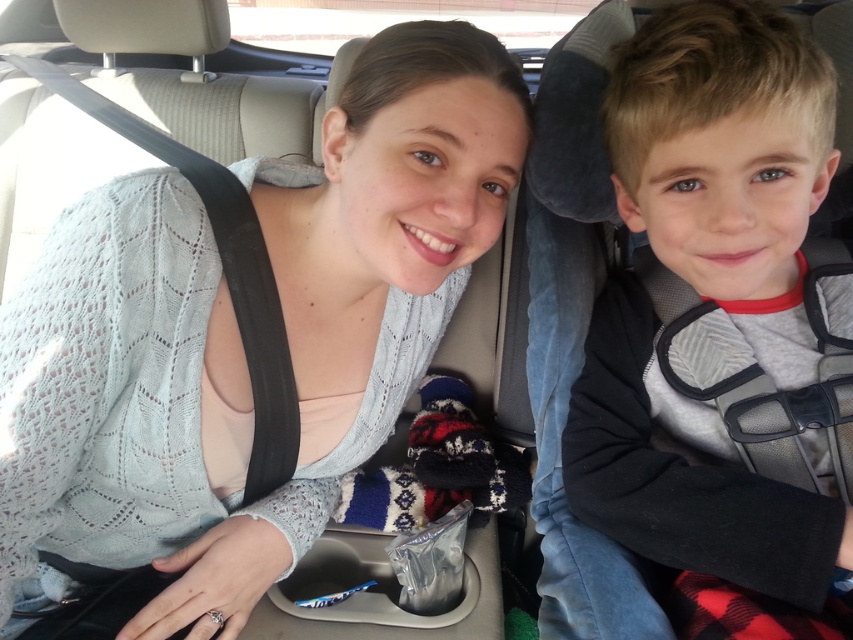
Question: Does light blue knitted sweater at center appear on the right side of gray fleece jacket at right?

Choices:
 (A) no
 (B) yes

Answer: (A)

Question: Is light blue knitted sweater at center further to the viewer compared to gray fleece jacket at right?

Choices:
 (A) no
 (B) yes

Answer: (A)

Question: Is light blue knitted sweater at center to the right of gray fleece jacket at right from the viewer's perspective?

Choices:
 (A) yes
 (B) no

Answer: (B)